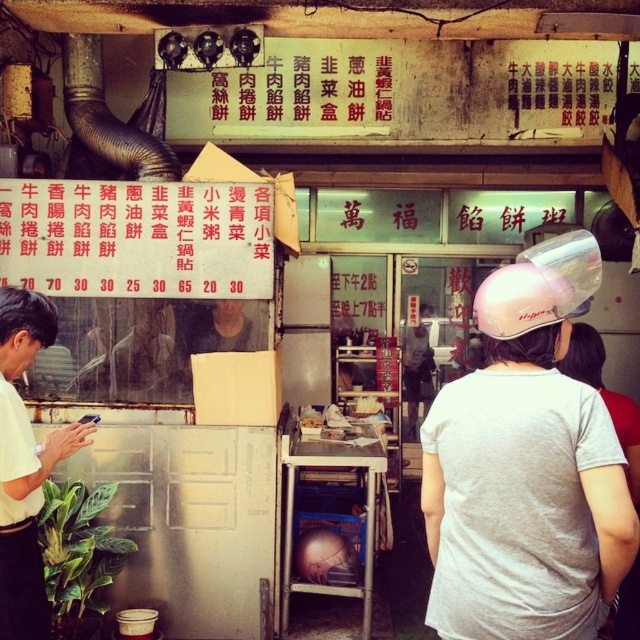
You are standing in front of the street food stall and want to take a photo of the menu board. You notice two points on the menu board at coordinates point (x=634, y=515) and point (x=208, y=289). Which point will appear closer to the edge of the photo frame if you center your camera on the menu board?

Point (x=208, y=289) will appear closer to the edge of the photo frame because it is farther from the viewer compared to point (x=634, y=515), which is closer. Since the camera is centered on the menu board, the farther point would naturally be positioned toward the edge.

You are a customer at the street food stall and want to read the menu. You notice a pink matte helmet at upper center and a red paper menu at center. Which item is bigger in size?

The pink matte helmet at upper center is larger in size than the red paper menu at center.

You are standing in front of the street food stall and want to take a photo of the menu board. You notice two points on the menu board at coordinates point (593,541) and point (51,340). Which point will appear closer to the edge of your camera frame?

Point (51,340) will appear closer to the edge of your camera frame because it is farther from the viewer compared to point (593,541), which is closer.